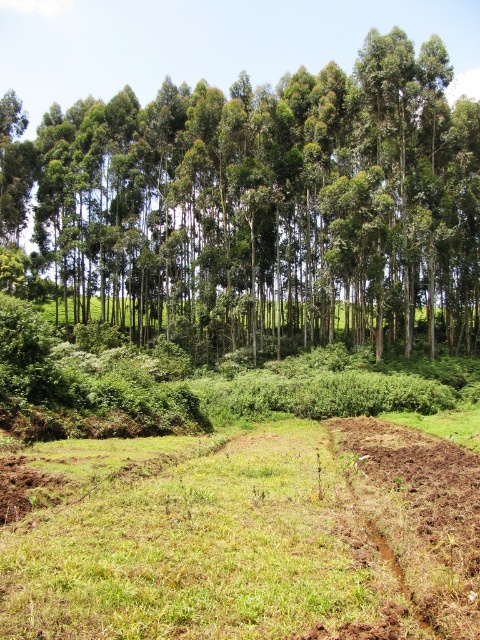
You are a farmer planning to plant new crops. You notice the green leafy trees at upper center and the brown soil at lower right. Which area should you prioritize for planting crops based on their visibility from the main path that runs along the lower edge of the image?

The brown soil at lower right is behind the green leafy trees at upper center, so it would be less visible from the main path. Therefore, you should prioritize planting crops in the area of the green leafy trees at upper center to ensure better visibility from the path.

You are a farmer planning to plant new crops in the brown soil at lower right. Considering the height of the green leafy trees at upper center, will their shade potentially block sunlight from reaching your new crops?

The green leafy trees at upper center are taller than the brown soil at lower right, so their shade could block sunlight from reaching the new crops planted in the brown soil at lower right.